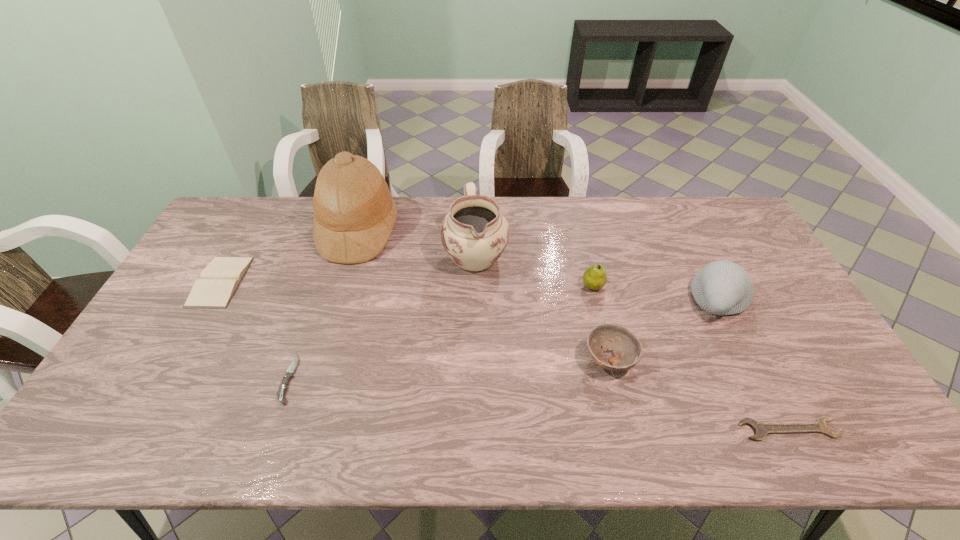
Locate an element on the screen. This screenshot has width=960, height=540. pitcher positioned at the far edge is located at coordinates (474, 233).

At what (x,y) coordinates should I click in order to perform the action: click on object at the near edge. Please return your answer as a coordinate pair (x, y). This screenshot has width=960, height=540. Looking at the image, I should click on (760, 429).

Locate an element on the screen. The height and width of the screenshot is (540, 960). object at the left edge is located at coordinates (219, 280).

What are the coordinates of `beanie that is positioned at the right edge` in the screenshot? It's located at point(722,287).

Where is `wrench that is at the right edge`? wrench that is at the right edge is located at coordinates (760, 429).

Where is `object at the near right corner`? The width and height of the screenshot is (960, 540). object at the near right corner is located at coordinates (760, 429).

This screenshot has width=960, height=540. Identify the location of free space at the far edge. (276, 218).

In order to click on free point at the near edge in this screenshot , I will do `click(250, 420)`.

Where is `free region at the left edge of the desktop`? free region at the left edge of the desktop is located at coordinates (239, 247).

You are a GUI agent. You are given a task and a screenshot of the screen. Output one action in this format:
    pyautogui.click(x=<x>, y=<y>)
    Task: Click on the vacant space at the right edge
    
    Given the screenshot: What is the action you would take?
    pyautogui.click(x=815, y=335)